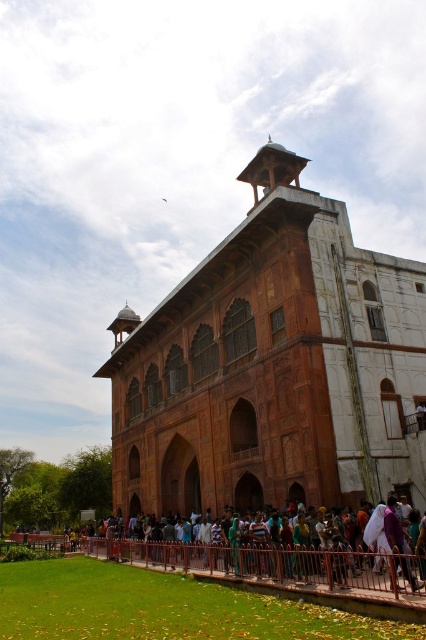
Consider the image. You are standing in a park and see the brown stone palace at center and the brown metal fence at lower center. Which object is located to the right of the other?

The brown stone palace at center is positioned on the right side of brown metal fence at lower center, so the palace is to the right of the fence.

You are standing at the point marked at (273, 384) in the image. You want to walk to the entrance of the building. How far will you have to walk in meters?

You will have to walk 48.12 meters to reach the entrance of the building from the point marked at (273, 384).

You are a tourist standing in front of the grand historical building. You notice the brown stone palace at center and the brown metal fence at lower center. Which object is positioned higher relative to the other?

The brown stone palace at center is located above the brown metal fence at lower center, so it is positioned higher.